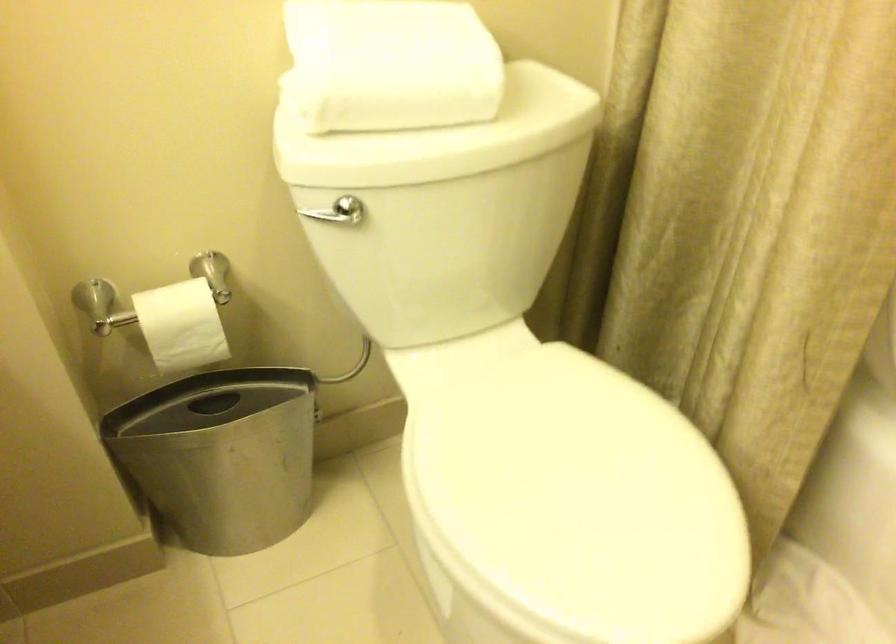
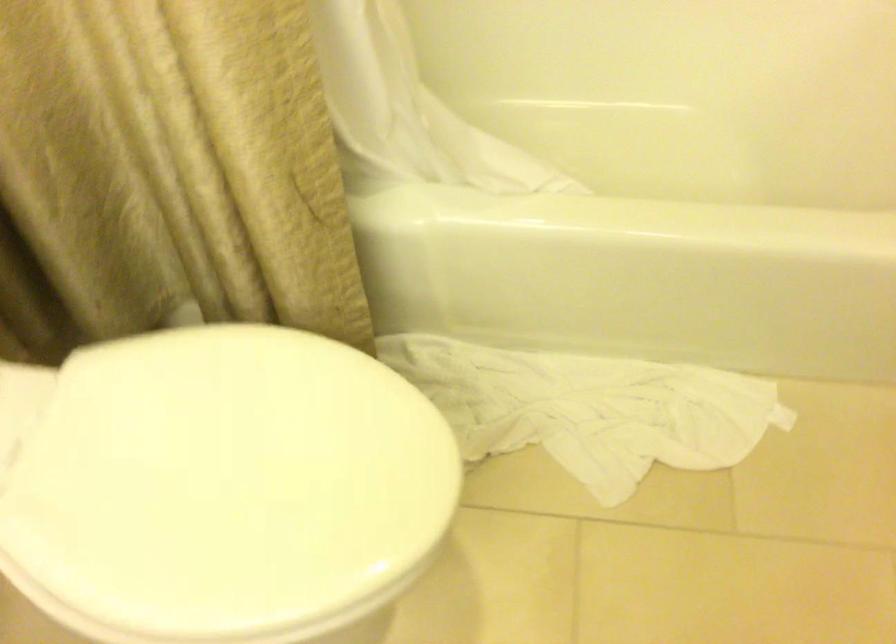
The first image is from the beginning of the video and the second image is from the end. How did the camera likely rotate when shooting the video?

The camera's rotation is toward right-down.